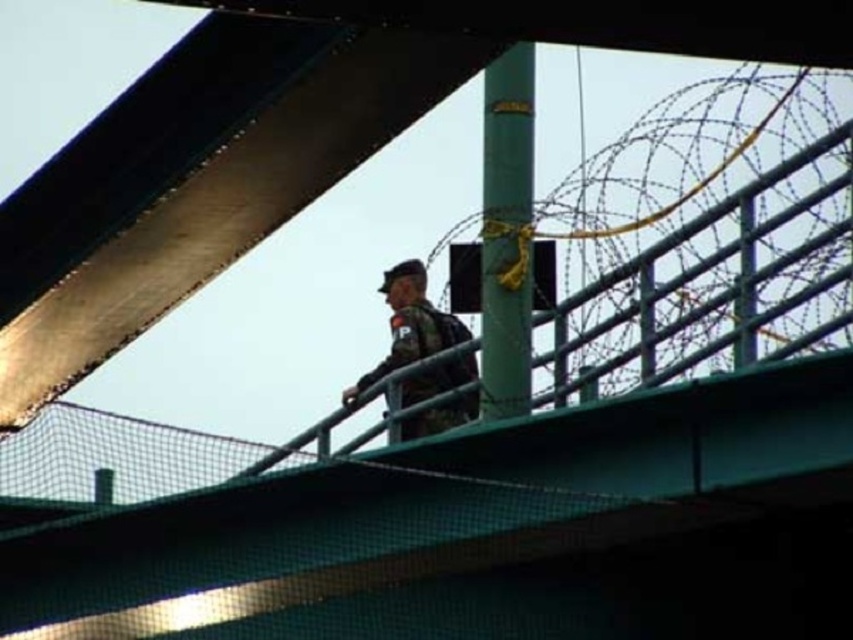
Which of these two, black mesh fence at upper center or camouflage fabric uniform at center, stands shorter?

black mesh fence at upper center is shorter.

Between black mesh fence at upper center and camouflage fabric uniform at center, which one is positioned higher?

Positioned higher is camouflage fabric uniform at center.

Describe the element at coordinates (114, 456) in the screenshot. I see `black mesh fence at upper center` at that location.

The height and width of the screenshot is (640, 853). I want to click on black mesh fence at upper center, so click(x=114, y=456).

Measure the distance from black mesh fence at upper center to green matte pole at center.

11.40 meters

Which is below, black mesh fence at upper center or green matte pole at center?

black mesh fence at upper center is below.

Locate an element on the screen. black mesh fence at upper center is located at coordinates (x=114, y=456).

Describe the element at coordinates (506, 230) in the screenshot. This screenshot has width=853, height=640. I see `green matte pole at center` at that location.

Is point (525, 170) positioned in front of point (412, 268)?

That is True.

Who is more forward, (482, 180) or (410, 288)?

Point (482, 180) is more forward.

Identify the location of green matte pole at center. This screenshot has height=640, width=853. [506, 230].